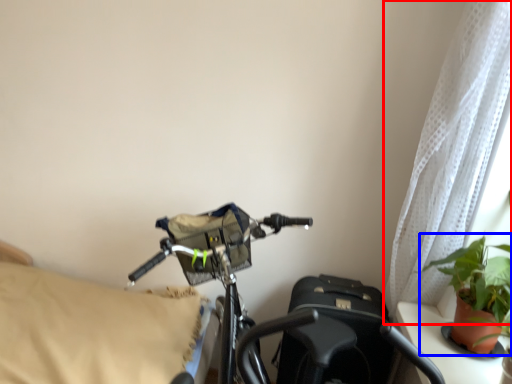
Question: Among these objects, which one is farthest to the camera, curtain (highlighted by a red box) or houseplant (highlighted by a blue box)?

Choices:
 (A) curtain
 (B) houseplant

Answer: (A)